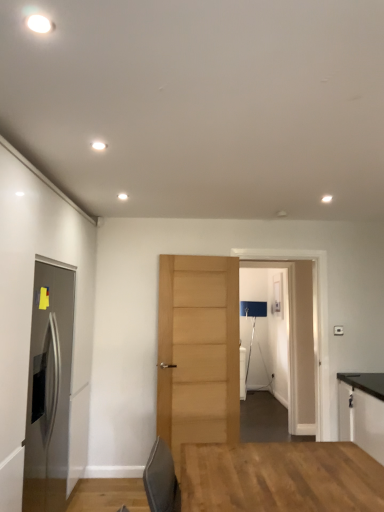
Question: Could you tell me if satin stainless steel refrigerator at left, the second door when ordered from right to left, is facing black laminate cabinet at right?

Choices:
 (A) yes
 (B) no

Answer: (A)

Question: Can you confirm if satin stainless steel refrigerator at left, arranged as the 1th door when viewed from the front, is positioned to the left of black laminate cabinet at right?

Choices:
 (A) yes
 (B) no

Answer: (A)

Question: Is satin stainless steel refrigerator at left, which ranks as the first door in left-to-right order, outside of black laminate cabinet at right?

Choices:
 (A) no
 (B) yes

Answer: (B)

Question: Is satin stainless steel refrigerator at left, acting as the second door starting from the back, in front of black laminate cabinet at right?

Choices:
 (A) yes
 (B) no

Answer: (A)

Question: From a real-world perspective, is satin stainless steel refrigerator at left, arranged as the 1th door when viewed from the front, on top of black laminate cabinet at right?

Choices:
 (A) yes
 (B) no

Answer: (A)

Question: From the image's perspective, is transparent glass door at center located above or below satin stainless steel refrigerator at left, acting as the second door starting from the back?

Choices:
 (A) below
 (B) above

Answer: (B)

Question: Which is correct: transparent glass door at center is inside satin stainless steel refrigerator at left, acting as the second door starting from the back, or outside of it?

Choices:
 (A) inside
 (B) outside

Answer: (B)

Question: Is point (268, 387) positioned closer to the camera than point (43, 506)?

Choices:
 (A) farther
 (B) closer

Answer: (A)

Question: Is transparent glass door at center taller or shorter than satin stainless steel refrigerator at left, the second door when ordered from right to left?

Choices:
 (A) short
 (B) tall

Answer: (B)

Question: Looking at the image, does light brown wood door at center, marked as the second door in a front-to-back arrangement, seem bigger or smaller compared to transparent glass door at center?

Choices:
 (A) small
 (B) big

Answer: (A)

Question: From a real-world perspective, is light brown wood door at center, the first door in the back-to-front sequence, above or below transparent glass door at center?

Choices:
 (A) above
 (B) below

Answer: (B)

Question: Is light brown wood door at center, which is the 1th door from right to left, wider or thinner than transparent glass door at center?

Choices:
 (A) thin
 (B) wide

Answer: (A)

Question: Considering the relative positions of light brown wood door at center, which is the 1th door from right to left, and transparent glass door at center in the image provided, is light brown wood door at center, which is the 1th door from right to left, to the left or to the right of transparent glass door at center?

Choices:
 (A) left
 (B) right

Answer: (A)

Question: Considering the positions of black laminate cabinet at right and transparent glass door at center in the image, is black laminate cabinet at right wider or thinner than transparent glass door at center?

Choices:
 (A) wide
 (B) thin

Answer: (A)

Question: In the image, is black laminate cabinet at right positioned in front of or behind transparent glass door at center?

Choices:
 (A) behind
 (B) front

Answer: (B)